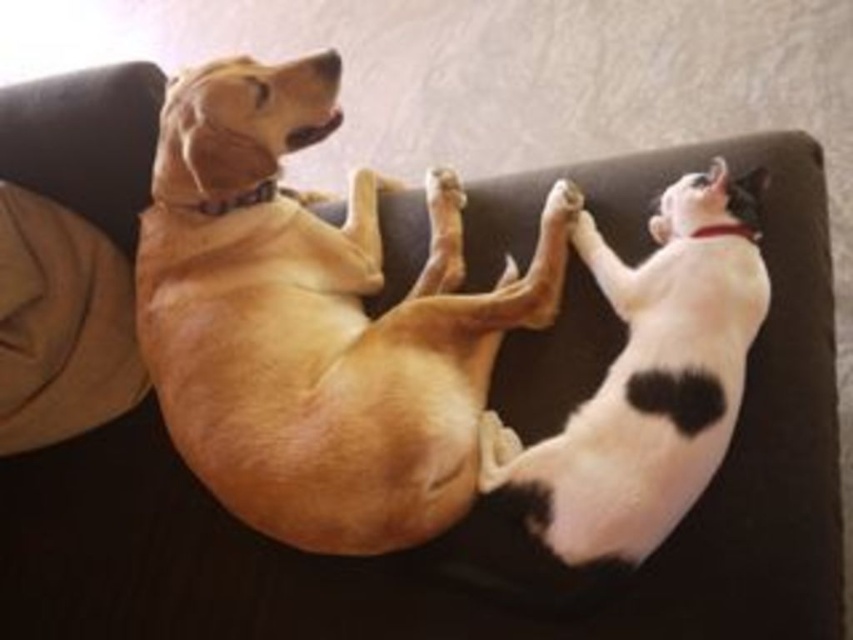
Question: Is white fur paw at center to the left of white fur paw at upper center from the viewer's perspective?

Choices:
 (A) no
 (B) yes

Answer: (B)

Question: Which of the following is the farthest from the observer?

Choices:
 (A) (635, 374)
 (B) (427, 179)

Answer: (B)

Question: Which point is closer to the camera?

Choices:
 (A) white fur paw at upper center
 (B) white fur paw at center
 (C) white matte dog at center

Answer: (C)

Question: Is white matte dog at center bigger than white fur paw at upper center?

Choices:
 (A) no
 (B) yes

Answer: (B)

Question: Does white matte dog at center come in front of white fur paw at upper center?

Choices:
 (A) yes
 (B) no

Answer: (A)

Question: Which point is farther to the camera?

Choices:
 (A) (548, 204)
 (B) (608, 552)

Answer: (A)